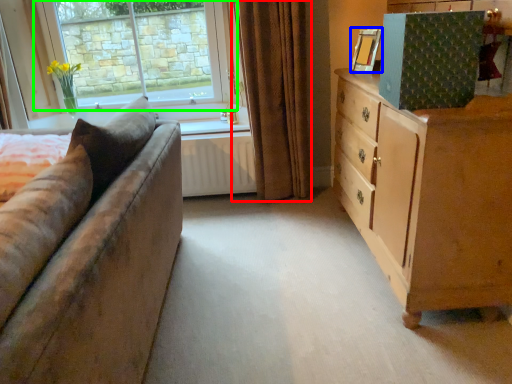
Question: Which object is positioned farthest from curtain (highlighted by a red box)? Select from picture frame (highlighted by a blue box) and window (highlighted by a green box).

Choices:
 (A) picture frame
 (B) window

Answer: (B)